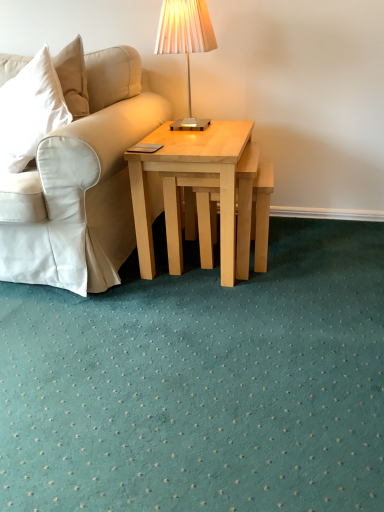
At what (x,y) coordinates should I click in order to perform the action: click on free spot in front of light wood stool at center. Please return your answer as a coordinate pair (x, y). The height and width of the screenshot is (512, 384). Looking at the image, I should click on (259, 292).